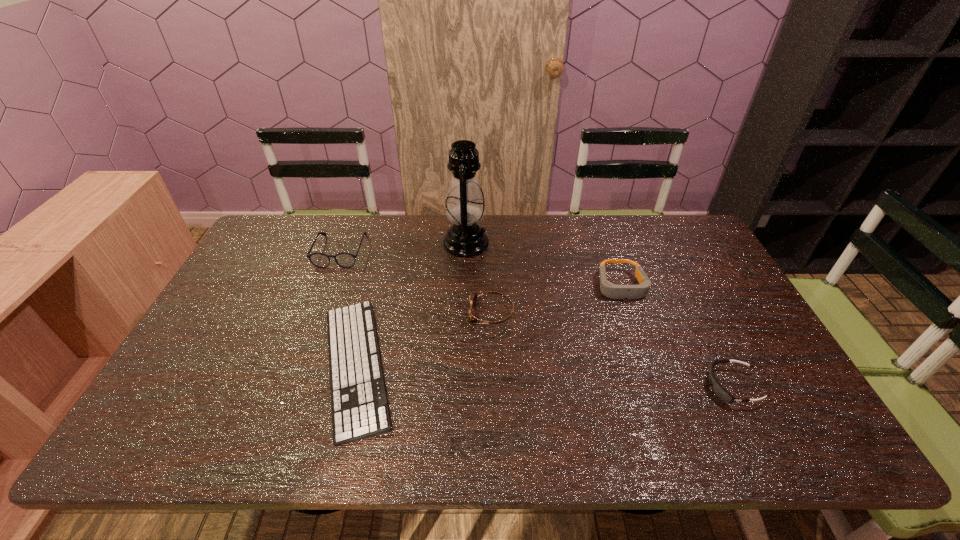
The image size is (960, 540). I want to click on the tallest object, so click(x=464, y=204).

Image resolution: width=960 pixels, height=540 pixels. I want to click on spectacles, so click(x=345, y=260).

I want to click on the fourth shortest object, so click(608, 289).

Identify the location of the tallest goggles. The image size is (960, 540). (608, 289).

I want to click on the leftmost goggles, so click(x=472, y=316).

Where is `the rightmost goggles`? This screenshot has width=960, height=540. the rightmost goggles is located at coordinates (718, 389).

Locate an element on the screen. the rightmost object is located at coordinates (718, 389).

Image resolution: width=960 pixels, height=540 pixels. I want to click on computer keyboard, so click(359, 408).

Locate an element on the screen. free space located on the right of the tallest object is located at coordinates (530, 243).

The height and width of the screenshot is (540, 960). In order to click on free space located 0.270m on the front-facing side of the spectacles in this screenshot , I will do `click(310, 333)`.